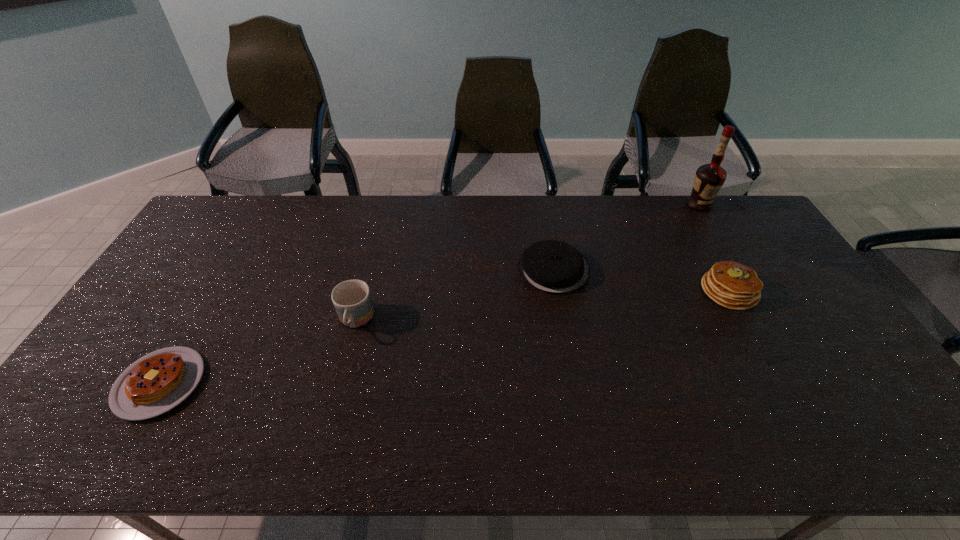
The width and height of the screenshot is (960, 540). Identify the location of liquor. (709, 178).

The width and height of the screenshot is (960, 540). In order to click on the tallest object in this screenshot , I will do `click(709, 178)`.

Locate an element on the screen. the second tallest object is located at coordinates (352, 300).

At what (x,y) coordinates should I click in order to perform the action: click on mug. Please return your answer as a coordinate pair (x, y). Image resolution: width=960 pixels, height=540 pixels. Looking at the image, I should click on pyautogui.click(x=352, y=300).

I want to click on the tallest pancake, so click(x=730, y=284).

Where is `the rightmost pancake`? the rightmost pancake is located at coordinates (730, 284).

Locate an element on the screen. This screenshot has width=960, height=540. the second pancake from right to left is located at coordinates (551, 266).

Image resolution: width=960 pixels, height=540 pixels. I want to click on the second shortest pancake, so point(551,266).

At what (x,y) coordinates should I click in order to perform the action: click on the shortest object. Please return your answer as a coordinate pair (x, y). Looking at the image, I should click on (157, 382).

The height and width of the screenshot is (540, 960). In order to click on the nearest object in this screenshot , I will do `click(157, 382)`.